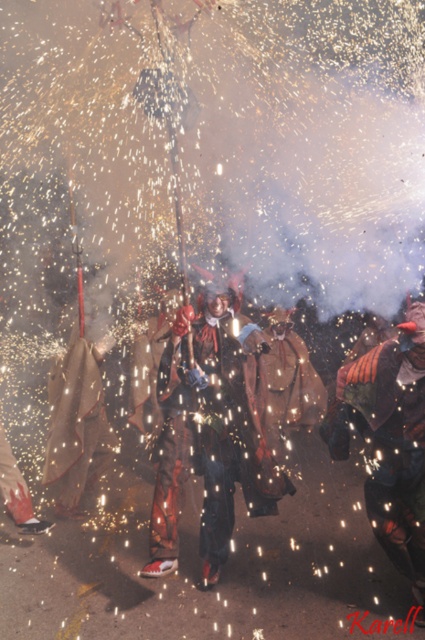
You are a photographer trying to capture the shiny metallic costume at center and the velvet orange cape at center in a single shot. Which one appears closer to your camera lens?

The shiny metallic costume at center appears closer to the camera lens because it is further to the viewer than the velvet orange cape at center.

You are a photographer at the event and want to capture both the shiny metallic costume at center and the velvet orange cape at center in a single frame. Which object should you focus on first to ensure both are in the frame?

The shiny metallic costume at center is bigger than the velvet orange cape at center, so you should focus on the shiny metallic costume at center first to ensure both are in the frame.